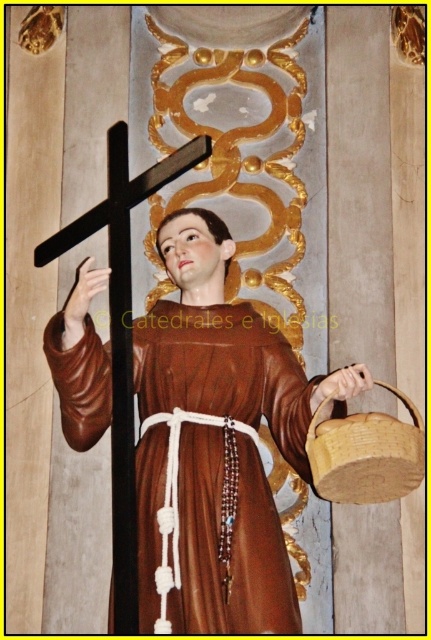
Which is more to the left, brown wooden statue at center or brown woven basket at lower right?

brown wooden statue at center is more to the left.

Does brown wooden statue at center lie in front of brown woven basket at lower right?

That is True.

This screenshot has height=640, width=431. In order to click on brown wooden statue at center in this screenshot , I will do `click(224, 346)`.

Based on the photo, between black wood cross at left and brown woven basket at lower right, which one has less height?

brown woven basket at lower right

Which is more to the left, black wood cross at left or brown woven basket at lower right?

From the viewer's perspective, black wood cross at left appears more on the left side.

Is point (124, 332) less distant than point (381, 432)?

No.

Where is `black wood cross at left`? Image resolution: width=431 pixels, height=640 pixels. black wood cross at left is located at coordinates (121, 328).

Which of these two, brown wooden statue at center or black wood cross at left, stands taller?

black wood cross at left

From the picture: Does brown wooden statue at center appear on the left side of black wood cross at left?

In fact, brown wooden statue at center is to the right of black wood cross at left.

The image size is (431, 640). What do you see at coordinates (224, 346) in the screenshot?
I see `brown wooden statue at center` at bounding box center [224, 346].

Find the location of a particular element. Image resolution: width=431 pixels, height=640 pixels. brown wooden statue at center is located at coordinates (224, 346).